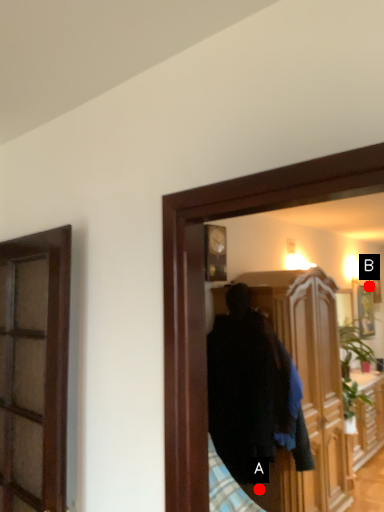
Question: Two points are circled on the image, labeled by A and B beside each circle. Which of the following is the closest to the observer?

Choices:
 (A) A is closer
 (B) B is closer

Answer: (A)